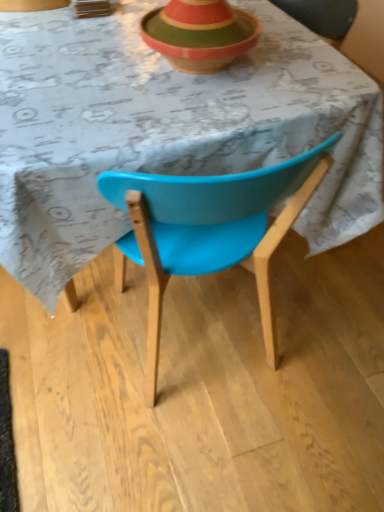
Image resolution: width=384 pixels, height=512 pixels. I want to click on vacant area that is in front of wooden striped bowl at upper center, so [184, 110].